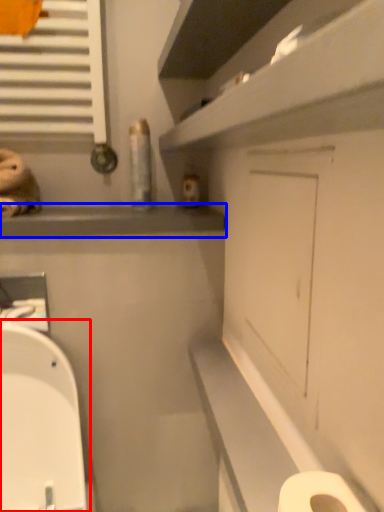
Question: Among these objects, which one is farthest to the camera, toilet (highlighted by a red box) or window sill (highlighted by a blue box)?

Choices:
 (A) toilet
 (B) window sill

Answer: (B)